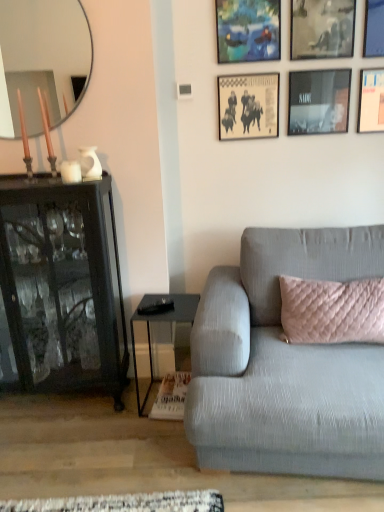
Find the location of a particular element. The image size is (384, 512). black plastic remote control at lower center is located at coordinates (156, 307).

What do you see at coordinates (156, 307) in the screenshot?
I see `black plastic remote control at lower center` at bounding box center [156, 307].

This screenshot has height=512, width=384. Describe the element at coordinates (62, 285) in the screenshot. I see `black glass cabinet at left` at that location.

What do you see at coordinates (374, 29) in the screenshot? I see `metallic silver picture frame at upper right, positioned as the sixth picture frame in left-to-right order` at bounding box center [374, 29].

This screenshot has height=512, width=384. I want to click on black glossy picture frame at upper right, which is the third picture frame in left-to-right order, so click(322, 29).

The height and width of the screenshot is (512, 384). Identify the location of remote control behind the matte glass mirror at upper left. (156, 307).

From the image's perspective, relative to black plastic remote control at lower center, is matte glass mirror at upper left above or below?

matte glass mirror at upper left is situated higher than black plastic remote control at lower center in the image.

Looking at this image, is matte glass mirror at upper left completely or partially outside of black plastic remote control at lower center?

That's correct, matte glass mirror at upper left is outside of black plastic remote control at lower center.

Considering the sizes of black glossy picture frame at upper right, the 4th picture frame from the left, and textured gray couch at right in the image, is black glossy picture frame at upper right, the 4th picture frame from the left, bigger or smaller than textured gray couch at right?

Clearly, black glossy picture frame at upper right, the 4th picture frame from the left, is smaller in size than textured gray couch at right.

Considering the points (291, 97) and (334, 351), which point is in front, point (291, 97) or point (334, 351)?

The point (334, 351) is in front.

Which is more to the left, black glossy picture frame at upper right, the 4th picture frame from the left, or textured gray couch at right?

From the viewer's perspective, textured gray couch at right appears more on the left side.

At what (x,y) coordinates should I click in order to perform the action: click on the 3rd picture frame above the textured gray couch at right (from a real-world perspective). Please return your answer as a coordinate pair (x, y). The width and height of the screenshot is (384, 512). Looking at the image, I should click on (319, 101).

Is black glass cabinet at left oriented towards metallic glass table at lower center?

No, black glass cabinet at left is not oriented towards metallic glass table at lower center.

Identify the location of table on the right of black glass cabinet at left. (161, 321).

From a real-world perspective, which object stands above the other?

black glass cabinet at left is physically above.

Can you see black glass cabinet at left touching metallic glass table at lower center?

No, black glass cabinet at left is not next to metallic glass table at lower center.

From a real-world perspective, is matte white picture frame at upper right, which ranks as the fifth picture frame in left-to-right order, positioned above or below metallic silver picture frame at upper right, positioned as the sixth picture frame in left-to-right order?

matte white picture frame at upper right, which ranks as the fifth picture frame in left-to-right order, is situated lower than metallic silver picture frame at upper right, positioned as the sixth picture frame in left-to-right order, in the real world.

How different are the orientations of matte white picture frame at upper right, which ranks as the fifth picture frame in left-to-right order, and metallic silver picture frame at upper right, positioned as the sixth picture frame in left-to-right order, in degrees?

0.00333 degrees separate the facing orientations of matte white picture frame at upper right, which ranks as the fifth picture frame in left-to-right order, and metallic silver picture frame at upper right, positioned as the sixth picture frame in left-to-right order.

How far apart are matte white picture frame at upper right, which ranks as the fifth picture frame in left-to-right order, and metallic silver picture frame at upper right, positioned as the sixth picture frame in left-to-right order?

They are 8.01 inches apart.

From the image's perspective, is matte white picture frame at upper right, which ranks as the fifth picture frame in left-to-right order, on top of metallic silver picture frame at upper right, positioned as the sixth picture frame in left-to-right order?

No, from the image's perspective, matte white picture frame at upper right, which ranks as the fifth picture frame in left-to-right order, is not above metallic silver picture frame at upper right, positioned as the sixth picture frame in left-to-right order.

Is black plastic remote control at lower center smaller than matte glass mirror at upper left?

Yes, black plastic remote control at lower center is smaller than matte glass mirror at upper left.

This screenshot has width=384, height=512. I want to click on remote control that appears on the right of matte glass mirror at upper left, so click(x=156, y=307).

Can you confirm if black plastic remote control at lower center is taller than matte glass mirror at upper left?

Incorrect, the height of black plastic remote control at lower center is not larger of that of matte glass mirror at upper left.

Between black plastic remote control at lower center and matte glass mirror at upper left, which one appears on the right side from the viewer's perspective?

Positioned to the right is black plastic remote control at lower center.

Identify the location of the 2nd picture frame behind when counting from the black glass cabinet at left. This screenshot has width=384, height=512. (248, 30).

Is blue textured fabric picture frame at upper center, the 1th picture frame in the left-to-right sequence, surrounded by black glass cabinet at left?

No, black glass cabinet at left does not contain blue textured fabric picture frame at upper center, the 1th picture frame in the left-to-right sequence.

Is point (22, 367) positioned before point (268, 23)?

Yes.

From the image's perspective, which one is positioned higher, black plastic remote control at lower center or metallic silver picture frame at upper right, the 1th picture frame in the right-to-left sequence?

metallic silver picture frame at upper right, the 1th picture frame in the right-to-left sequence, from the image's perspective.

How different are the orientations of black plastic remote control at lower center and metallic silver picture frame at upper right, positioned as the sixth picture frame in left-to-right order, in degrees?

There is a 20.7-degree angle between the facing directions of black plastic remote control at lower center and metallic silver picture frame at upper right, positioned as the sixth picture frame in left-to-right order.

In the image, is black plastic remote control at lower center positioned in front of or behind metallic silver picture frame at upper right, the 1th picture frame in the right-to-left sequence?

black plastic remote control at lower center is in front of metallic silver picture frame at upper right, the 1th picture frame in the right-to-left sequence.

At what (x,y) coordinates should I click in order to perform the action: click on picture frame that is the 6th one when counting rightward from the black plastic remote control at lower center. Please return your answer as a coordinate pair (x, y). Looking at the image, I should click on (374, 29).

This screenshot has height=512, width=384. Find the location of `remote control below the matte glass mirror at upper left (from the image's perspective)`. remote control below the matte glass mirror at upper left (from the image's perspective) is located at coordinates (156, 307).

At what (x,y) coordinates should I click in order to perform the action: click on studio couch on the left side of black glossy picture frame at upper right, the 4th picture frame from the left. Please return your answer as a coordinate pair (x, y). The width and height of the screenshot is (384, 512). Looking at the image, I should click on (285, 364).

Based on their spatial positions, is metallic silver picture frame at upper right, positioned as the sixth picture frame in left-to-right order, or black glass cabinet at left further from blue textured fabric picture frame at upper center, positioned as the 6th picture frame in right-to-left order?

black glass cabinet at left lies further to blue textured fabric picture frame at upper center, positioned as the 6th picture frame in right-to-left order, than the other object.

Based on their spatial positions, is black glass cabinet at left or matte glass mirror at upper left further from beige paper picture frame at upper center, the second picture frame from the left?

black glass cabinet at left.

Considering their positions, is metallic silver picture frame at upper right, the 1th picture frame in the right-to-left sequence, positioned further to blue textured fabric picture frame at upper center, positioned as the 6th picture frame in right-to-left order, than black glossy picture frame at upper right, the fourth picture frame positioned from the right?

Based on the image, metallic silver picture frame at upper right, the 1th picture frame in the right-to-left sequence, appears to be further to blue textured fabric picture frame at upper center, positioned as the 6th picture frame in right-to-left order.

From the image, which object appears to be farther from metallic silver picture frame at upper right, the 1th picture frame in the right-to-left sequence, metallic glass table at lower center or matte glass mirror at upper left?

Based on the image, metallic glass table at lower center appears to be further to metallic silver picture frame at upper right, the 1th picture frame in the right-to-left sequence.

Considering their positions, is beige paper picture frame at upper center, the second picture frame from the left, positioned closer to black glossy picture frame at upper right, which appears as the third picture frame when viewed from the right, than black glossy picture frame at upper right, which is the third picture frame in left-to-right order?

black glossy picture frame at upper right, which is the third picture frame in left-to-right order, lies closer to black glossy picture frame at upper right, which appears as the third picture frame when viewed from the right, than the other object.

From the picture: Which object lies further to the anchor point matte glass mirror at upper left, beige paper picture frame at upper center, which ranks as the 5th picture frame in right-to-left order, or matte white picture frame at upper right, positioned as the second picture frame in right-to-left order?

Based on the image, matte white picture frame at upper right, positioned as the second picture frame in right-to-left order, appears to be further to matte glass mirror at upper left.

From the image, which object appears to be nearer to black glossy picture frame at upper right, the fourth picture frame positioned from the right, textured gray couch at right or matte white picture frame at upper right, which ranks as the fifth picture frame in left-to-right order?

matte white picture frame at upper right, which ranks as the fifth picture frame in left-to-right order, is positioned closer to the anchor black glossy picture frame at upper right, the fourth picture frame positioned from the right.

Which object lies further to the anchor point black glossy picture frame at upper right, which is the third picture frame in left-to-right order, black plastic remote control at lower center or metallic silver picture frame at upper right, positioned as the sixth picture frame in left-to-right order?

black plastic remote control at lower center is positioned further to the anchor black glossy picture frame at upper right, which is the third picture frame in left-to-right order.

Find the location of a particular element. The height and width of the screenshot is (512, 384). remote control between black glossy picture frame at upper right, the 4th picture frame from the left, and textured gray couch at right in the up-down direction is located at coordinates (156, 307).

The width and height of the screenshot is (384, 512). Find the location of `studio couch between black glass cabinet at left and matte white picture frame at upper right, positioned as the second picture frame in right-to-left order`. studio couch between black glass cabinet at left and matte white picture frame at upper right, positioned as the second picture frame in right-to-left order is located at coordinates click(x=285, y=364).

Image resolution: width=384 pixels, height=512 pixels. What are the coordinates of `mirror located between black glass cabinet at left and textured gray couch at right in the left-right direction` in the screenshot? It's located at (43, 58).

Locate an element on the screen. Image resolution: width=384 pixels, height=512 pixels. cabinetry between beige paper picture frame at upper center, the second picture frame from the left, and black plastic remote control at lower center, in the vertical direction is located at coordinates (62, 285).